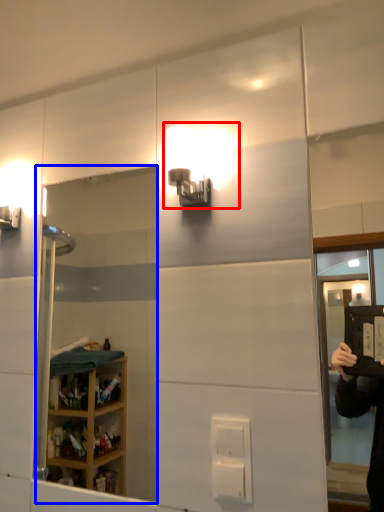
Question: Which object appears closest to the camera in this image, light fixture (highlighted by a red box) or mirror (highlighted by a blue box)?

Choices:
 (A) light fixture
 (B) mirror

Answer: (A)